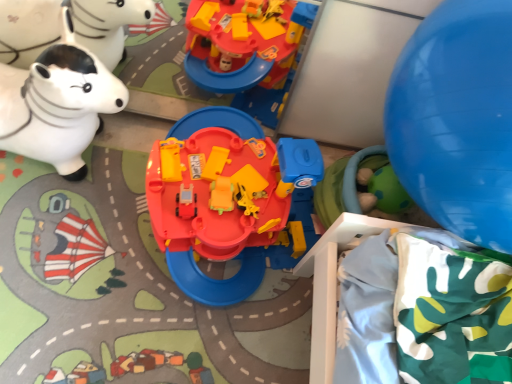
Question: Can you confirm if green rubber ball at lower right, which is the first toy from right to left, is smaller than blue rubber balloon at right?

Choices:
 (A) no
 (B) yes

Answer: (B)

Question: Does green rubber ball at lower right, which is the first toy from right to left, lie behind blue rubber balloon at right?

Choices:
 (A) yes
 (B) no

Answer: (A)

Question: Does green rubber ball at lower right, which is the first toy from right to left, appear on the left side of blue rubber balloon at right?

Choices:
 (A) yes
 (B) no

Answer: (A)

Question: Are green rubber ball at lower right, positioned as the third toy in left-to-right order, and blue rubber balloon at right far apart?

Choices:
 (A) yes
 (B) no

Answer: (B)

Question: Is green rubber ball at lower right, positioned as the third toy in left-to-right order, facing towards blue rubber balloon at right?

Choices:
 (A) no
 (B) yes

Answer: (A)

Question: Does green rubber ball at lower right, positioned as the third toy in left-to-right order, contain blue rubber balloon at right?

Choices:
 (A) yes
 (B) no

Answer: (B)

Question: Can you confirm if matte plastic playset at center, which ranks as the 2th toy in left-to-right order, is taller than white glossy rocking horse at left, arranged as the third toy when viewed from the right?

Choices:
 (A) no
 (B) yes

Answer: (A)

Question: Is the surface of matte plastic playset at center, which ranks as the 2th toy in left-to-right order, in direct contact with white glossy rocking horse at left, arranged as the third toy when viewed from the right?

Choices:
 (A) yes
 (B) no

Answer: (B)

Question: Can you confirm if matte plastic playset at center, positioned as the second toy in right-to-left order, is positioned to the right of white glossy rocking horse at left, arranged as the third toy when viewed from the right?

Choices:
 (A) yes
 (B) no

Answer: (A)

Question: Is matte plastic playset at center, positioned as the second toy in right-to-left order, oriented away from white glossy rocking horse at left, arranged as the third toy when viewed from the right?

Choices:
 (A) no
 (B) yes

Answer: (A)

Question: Is matte plastic playset at center, which ranks as the 2th toy in left-to-right order, not inside white glossy rocking horse at left, arranged as the third toy when viewed from the right?

Choices:
 (A) yes
 (B) no

Answer: (A)

Question: Can you confirm if matte plastic playset at center, which ranks as the 2th toy in left-to-right order, is thinner than white glossy rocking horse at left, acting as the 1th toy starting from the left?

Choices:
 (A) no
 (B) yes

Answer: (A)

Question: Is white glossy rocking horse at left, arranged as the third toy when viewed from the right, completely or partially outside of blue rubber balloon at right?

Choices:
 (A) no
 (B) yes

Answer: (B)